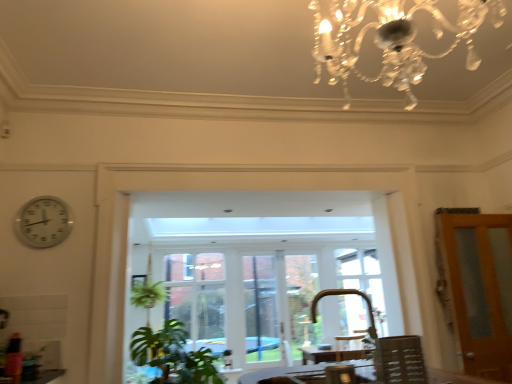
Question: Is clear glass window at center closer to camera compared to gold metallic faucet at lower center?

Choices:
 (A) yes
 (B) no

Answer: (B)

Question: From the image's perspective, is clear glass window at center under gold metallic faucet at lower center?

Choices:
 (A) no
 (B) yes

Answer: (B)

Question: Would you consider clear glass window at center to be distant from gold metallic faucet at lower center?

Choices:
 (A) no
 (B) yes

Answer: (B)

Question: Considering the relative sizes of clear glass window at center and gold metallic faucet at lower center in the image provided, is clear glass window at center smaller than gold metallic faucet at lower center?

Choices:
 (A) no
 (B) yes

Answer: (A)

Question: From the image's perspective, is clear glass window at center over gold metallic faucet at lower center?

Choices:
 (A) yes
 (B) no

Answer: (B)

Question: Is clear glass window at center next to gold metallic faucet at lower center and touching it?

Choices:
 (A) yes
 (B) no

Answer: (B)

Question: From a real-world perspective, is brown wooden door at right beneath white plastic clock at left?

Choices:
 (A) no
 (B) yes

Answer: (B)

Question: Can you confirm if brown wooden door at right is shorter than white plastic clock at left?

Choices:
 (A) yes
 (B) no

Answer: (B)

Question: Can white plastic clock at left be found inside brown wooden door at right?

Choices:
 (A) yes
 (B) no

Answer: (B)

Question: Can you confirm if brown wooden door at right is smaller than white plastic clock at left?

Choices:
 (A) yes
 (B) no

Answer: (B)

Question: Considering the relative sizes of brown wooden door at right and white plastic clock at left in the image provided, is brown wooden door at right thinner than white plastic clock at left?

Choices:
 (A) no
 (B) yes

Answer: (A)

Question: From a real-world perspective, is brown wooden door at right on top of white plastic clock at left?

Choices:
 (A) no
 (B) yes

Answer: (A)

Question: Does brown wooden door at right have a lesser height compared to white wood window frame at center?

Choices:
 (A) no
 (B) yes

Answer: (B)